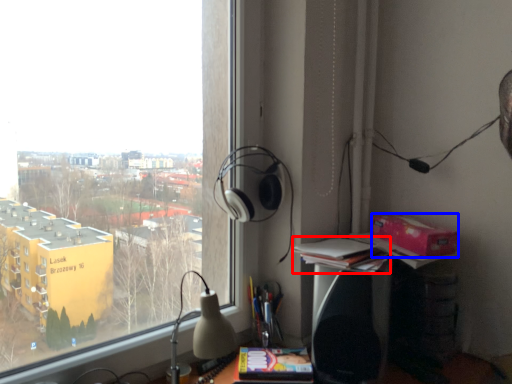
Question: Which point is further to the camera, book (highlighted by a red box) or cardboard box (highlighted by a blue box)?

Choices:
 (A) book
 (B) cardboard box

Answer: (B)